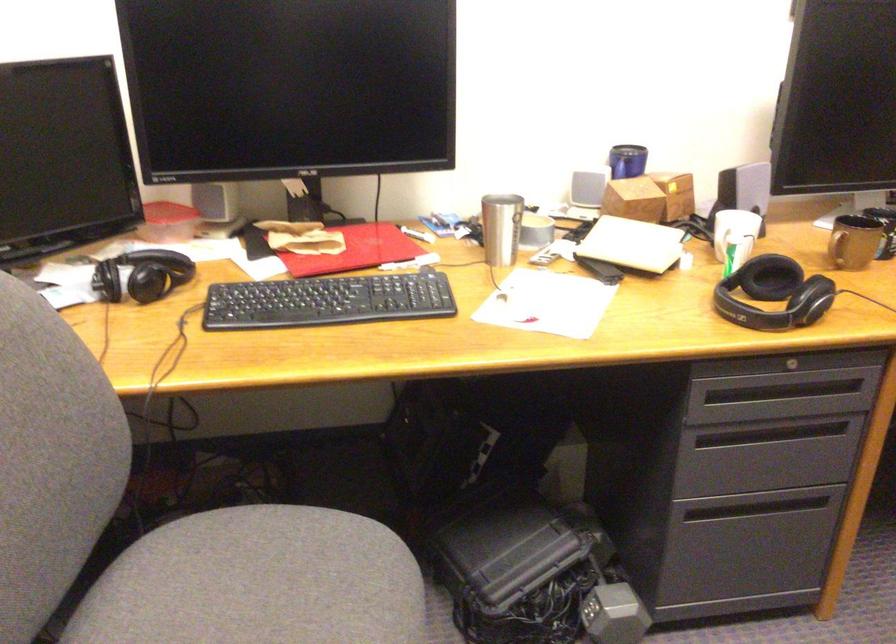
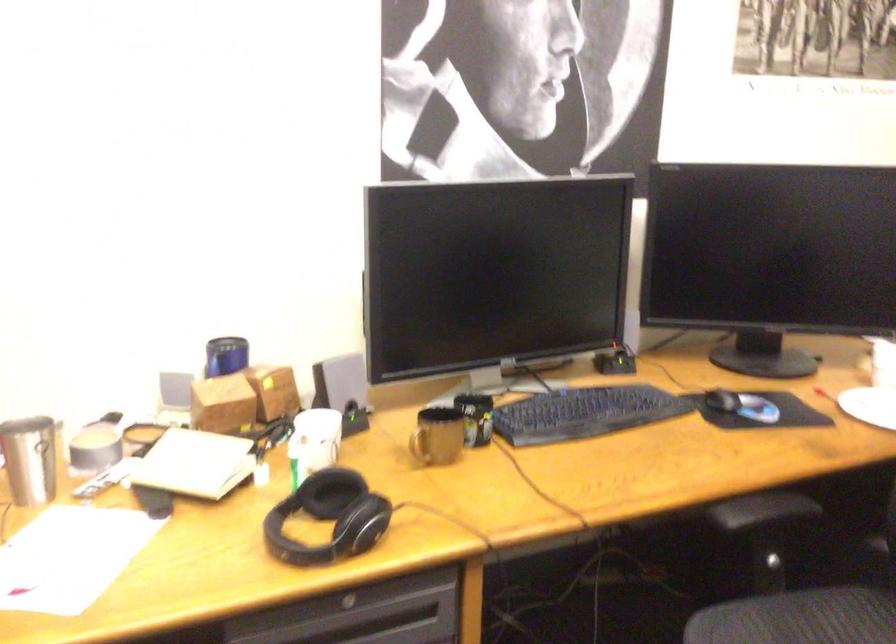
The point at (x=506, y=220) is marked in the first image. Where is the corresponding point in the second image?

(30, 459)